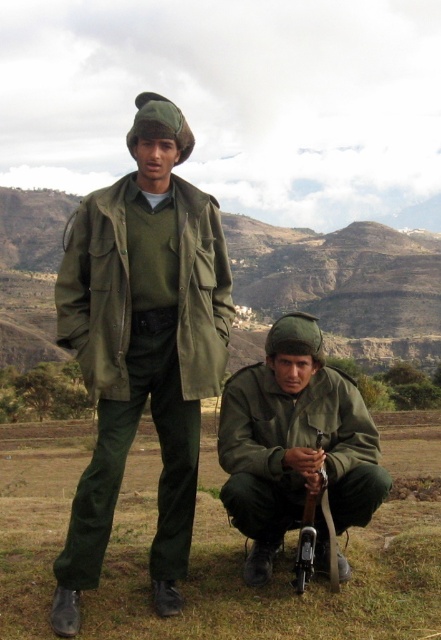
You are an observer looking at the scene. Where is the matte green uniform at center located in terms of coordinates?

The matte green uniform at center is located at coordinates point (142, 346).

You are a drone operator controlling a drone that needs to maintain a minimum distance of 20 meters from any object to avoid collision. You are currently flying over a rural area where you see a matte green uniform at center. Is the current distance safe?

The matte green uniform at center is 25.97 meters away from the camera, which is above the minimum required distance of 20 meters. Therefore, the current distance is safe.

You are a photographer trying to capture a group photo of the two individuals in the scene. Since you want to ensure that both are visible in the frame, which of the two individuals wearing matte green uniform at center and matte green uniform at lower center should stand closer to the camera to avoid being obscured by the other?

The matte green uniform at lower center should stand closer to the camera because the matte green uniform at center is much taller and could potentially block the view of the shorter individual if they are positioned further back.